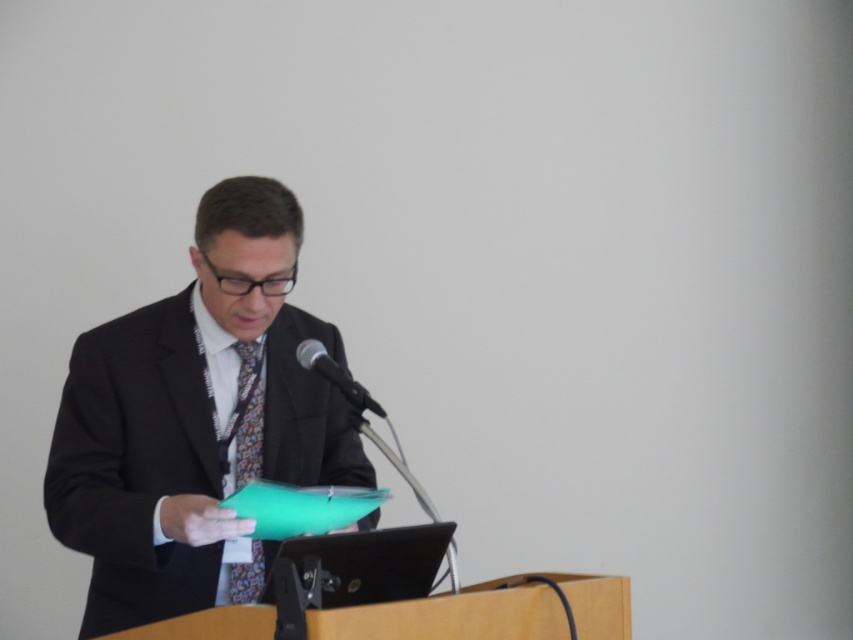
Is matte black suit at center wider than black metallic microphone at center?

Yes.

Does matte black suit at center have a greater height compared to black metallic microphone at center?

Correct, matte black suit at center is much taller as black metallic microphone at center.

What do you see at coordinates (195, 419) in the screenshot? Image resolution: width=853 pixels, height=640 pixels. I see `matte black suit at center` at bounding box center [195, 419].

Where is `matte black suit at center`? The width and height of the screenshot is (853, 640). matte black suit at center is located at coordinates (195, 419).

Does floral silk tie at center have a greater height compared to black metallic microphone at center?

Yes.

Does floral silk tie at center come in front of black metallic microphone at center?

No, floral silk tie at center is further to the viewer.

What do you see at coordinates (248, 410) in the screenshot? I see `floral silk tie at center` at bounding box center [248, 410].

Find the location of a particular element. floral silk tie at center is located at coordinates (248, 410).

Can you confirm if matte black suit at center is shorter than floral silk tie at center?

No, matte black suit at center is not shorter than floral silk tie at center.

Is the position of matte black suit at center less distant than that of floral silk tie at center?

Yes, it is.

Locate an element on the screen. Image resolution: width=853 pixels, height=640 pixels. matte black suit at center is located at coordinates (195, 419).